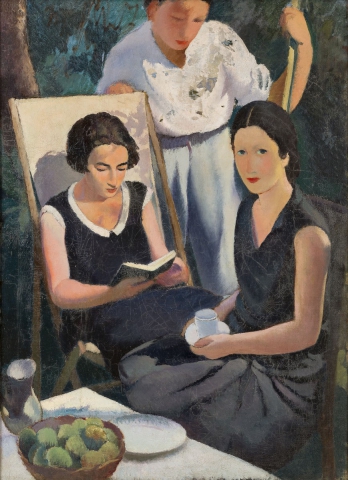
I want to click on painting, green background, so click(x=264, y=26).